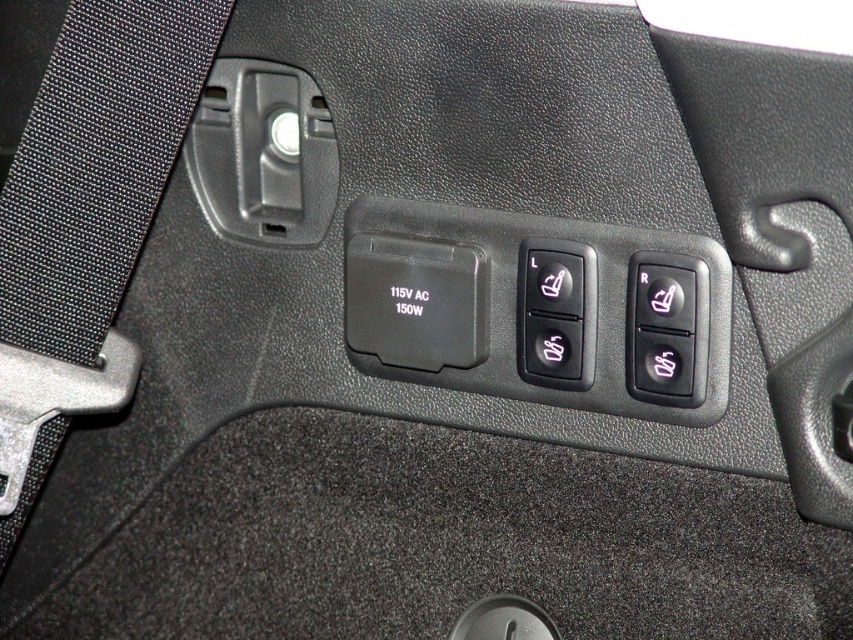
Looking at this image, measure the distance between black fabric seatbelt at left and camera.

98.71 centimeters

Can you confirm if black fabric seatbelt at left is taller than black plastic button at center?

Indeed, black fabric seatbelt at left has a greater height compared to black plastic button at center.

This screenshot has height=640, width=853. What do you see at coordinates (88, 208) in the screenshot?
I see `black fabric seatbelt at left` at bounding box center [88, 208].

Where is `black fabric seatbelt at left`? This screenshot has width=853, height=640. black fabric seatbelt at left is located at coordinates (88, 208).

Is black plastic button at center bigger than black plastic seat adjustment button at right?

Yes, black plastic button at center is bigger than black plastic seat adjustment button at right.

This screenshot has height=640, width=853. What do you see at coordinates (556, 314) in the screenshot? I see `black plastic button at center` at bounding box center [556, 314].

Does point (547, 253) come in front of point (654, 340)?

That is False.

Locate an element on the screen. black plastic button at center is located at coordinates (556, 314).

Does black fabric seatbelt at left lie behind black plastic seat adjustment button at right?

No, black fabric seatbelt at left is closer to the viewer.

Does black fabric seatbelt at left have a smaller size compared to black plastic seat adjustment button at right?

No, black fabric seatbelt at left is not smaller than black plastic seat adjustment button at right.

Who is more distant from viewer, (132, 68) or (660, 362)?

The point (660, 362) is more distant.

This screenshot has height=640, width=853. In order to click on black fabric seatbelt at left in this screenshot , I will do `click(88, 208)`.